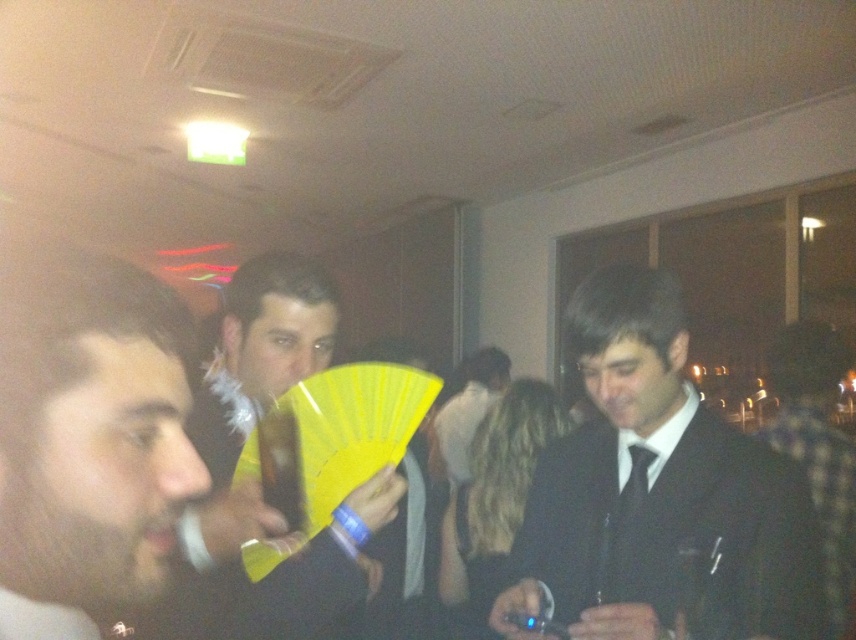
Question: Among these points, which one is nearest to the camera?

Choices:
 (A) (828, 499)
 (B) (554, 486)
 (C) (247, 280)
 (D) (456, 460)

Answer: (C)

Question: Among these points, which one is farthest from the camera?

Choices:
 (A) (312, 552)
 (B) (847, 484)
 (C) (453, 451)
 (D) (518, 632)

Answer: (C)

Question: Can you confirm if black satin suit at right is positioned below patterned fabric shirt at right?

Choices:
 (A) yes
 (B) no

Answer: (B)

Question: Is yellow paper fan at center further to the viewer compared to patterned fabric shirt at right?

Choices:
 (A) yes
 (B) no

Answer: (B)

Question: Observing the image, what is the correct spatial positioning of black satin suit at right in reference to yellow paper fan at center?

Choices:
 (A) below
 (B) above

Answer: (A)

Question: Which point is farther to the camera?

Choices:
 (A) (468, 465)
 (B) (635, 433)
 (C) (308, 353)
 (D) (837, 620)

Answer: (A)